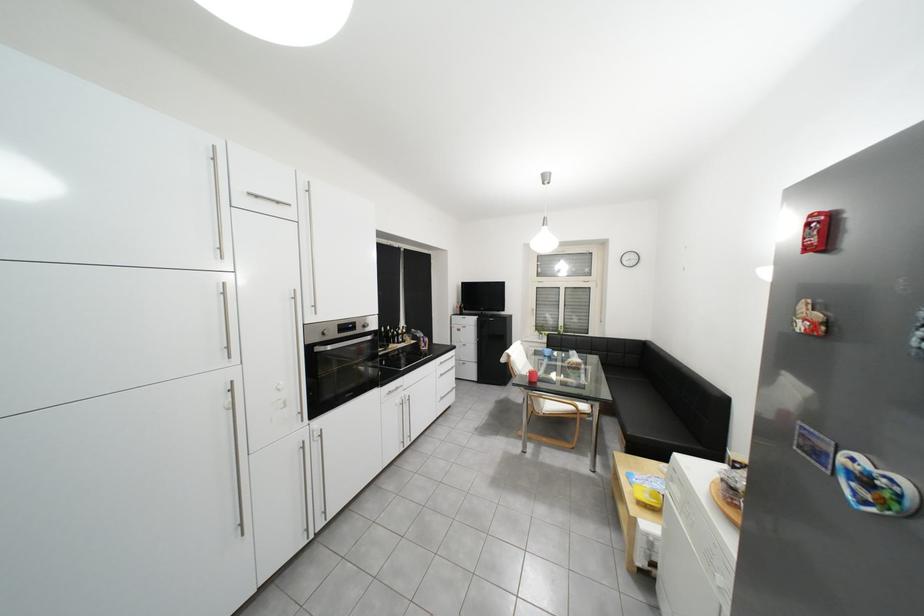
Image resolution: width=924 pixels, height=616 pixels. Describe the element at coordinates (555, 406) in the screenshot. I see `the chair armrest` at that location.